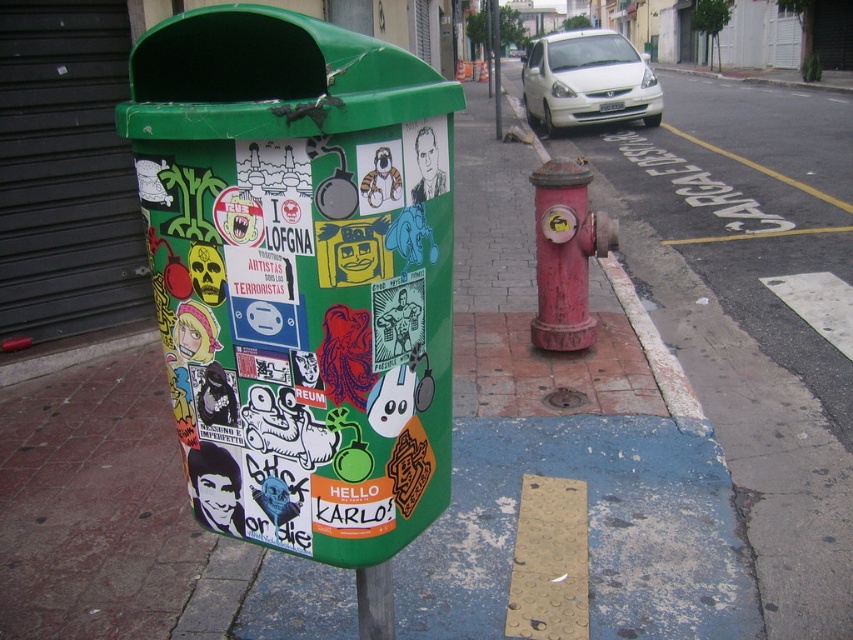
You are a delivery person trying to park your bike. You see the smooth concrete sidewalk at center and the red painted concrete curb at right. Which area is larger in size?

The smooth concrete sidewalk at center has a smaller size compared to the red painted concrete curb at right, so the red painted concrete curb at right is larger in size.

You are a city planner reviewing the layout of the urban street scene. The city requires all fire hydrants to be placed at least 1.5 meters away from the curb. Given the coordinates of the rusty metal hydrant at center, can you determine if it meets this regulation?

The position of the rusty metal hydrant at center is at point (566, 253). Without knowing the exact distance from the curb, it is impossible to determine if it meets the 1.5 meters requirement.

You are a delivery person trying to park your bike. You see the smooth concrete sidewalk at center and the red painted concrete curb at right. According to local regulations, bikes must be parked on the left side of the curb. Which surface should you park your bike on?

The smooth concrete sidewalk at center is positioned on the right side of the red painted concrete curb at right. Therefore, to comply with the regulation, you should park your bike on the smooth concrete sidewalk at center since it is to the left of the curb.